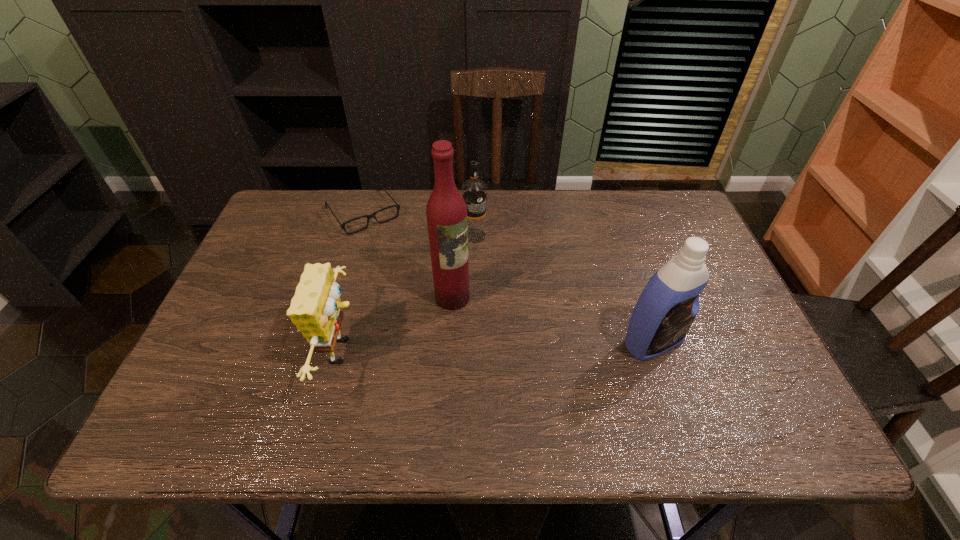
I want to click on empty space that is in between the sponge and the liquor, so click(398, 325).

Find the location of a particular element. free area in between the tallest object and the sponge is located at coordinates (398, 325).

You are a GUI agent. You are given a task and a screenshot of the screen. Output one action in this format:
    pyautogui.click(x=<x>, y=<y>)
    Task: Click on the empty space that is in between the liquor and the spectacles
    
    Given the screenshot: What is the action you would take?
    pyautogui.click(x=408, y=255)

Locate an element on the screen. free area in between the liquor and the detergent is located at coordinates (553, 320).

This screenshot has height=540, width=960. In order to click on blank region between the shortest object and the tallest object in this screenshot , I will do pos(408,255).

Identify the location of empty space between the sponge and the vodka. tap(409, 293).

Identify the location of free point between the shortest object and the liquor. This screenshot has height=540, width=960. (408, 255).

Locate an element on the screen. vacant area between the rightmost object and the liquor is located at coordinates (553, 320).

Point out which object is positioned as the third nearest to the spectacles. Please provide its 2D coordinates. Your answer should be formatted as a tuple, i.e. [(x, y)], where the tuple contains the x and y coordinates of a point satisfying the conditions above.

[(316, 309)]

Where is `object that is the closest one to the sponge`? object that is the closest one to the sponge is located at coordinates (446, 212).